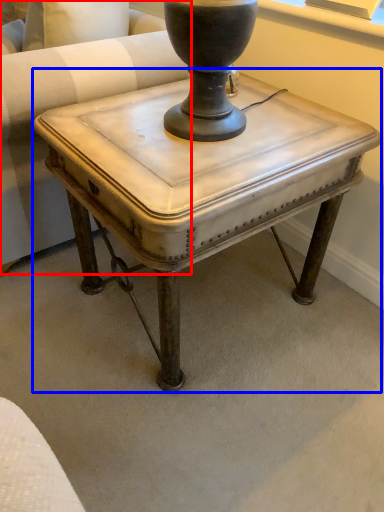
Question: Which object appears farthest to the camera in this image, swivel chair (highlighted by a red box) or table (highlighted by a blue box)?

Choices:
 (A) swivel chair
 (B) table

Answer: (A)